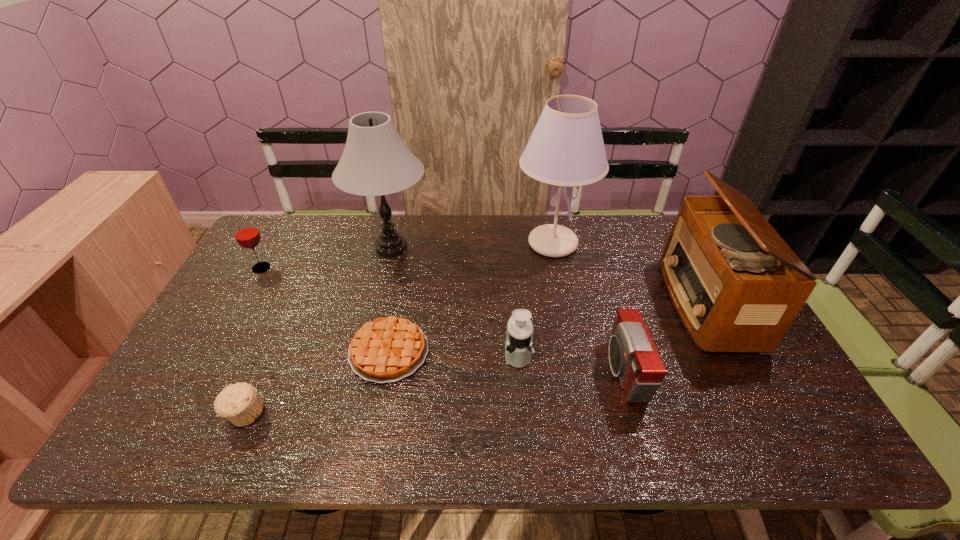
The width and height of the screenshot is (960, 540). I want to click on vacant area at the right edge, so click(x=742, y=401).

Image resolution: width=960 pixels, height=540 pixels. Identify the location of blank space at the far left corner. [x=279, y=240].

I want to click on free space at the near left corner, so click(146, 437).

Locate an element on the screen. vacant space that is in between the lamp and the leftmost object is located at coordinates (326, 258).

Identify the location of unoccupied area between the radio receiver and the camera. pos(664,337).

The image size is (960, 540). Identify the location of vacant area that lies between the pie and the seventh tallest object. (317, 382).

I want to click on vacant space that's between the lamp and the shortest object, so click(390, 300).

This screenshot has height=540, width=960. Find the location of `free space that is in between the muffin and the shortest object`. free space that is in between the muffin and the shortest object is located at coordinates (317, 382).

Locate an element on the screen. The width and height of the screenshot is (960, 540). empty space between the lampshade and the pie is located at coordinates coord(471,298).

I want to click on free spot between the shortest object and the glass, so click(x=325, y=310).